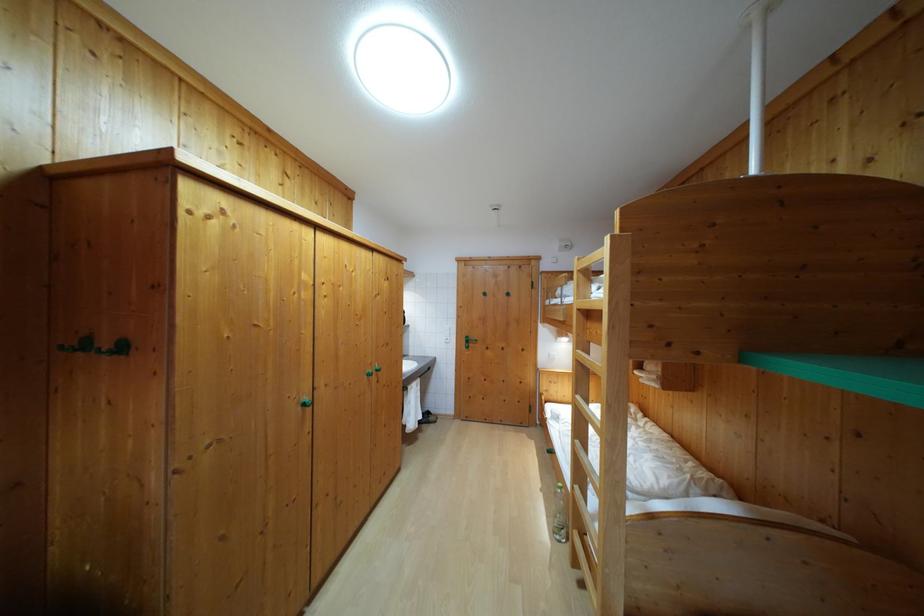
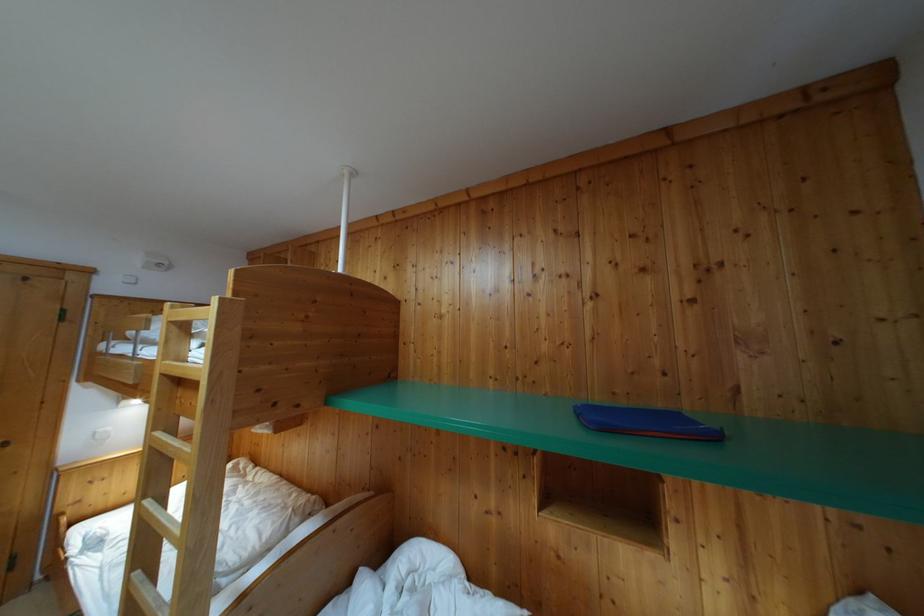
Question: The camera is either moving clockwise (left) or counter-clockwise (right) around the object. The first image is from the beginning of the video and the second image is from the end. Is the camera moving left or right when shooting the video?

Choices:
 (A) Left
 (B) Right

Answer: (A)